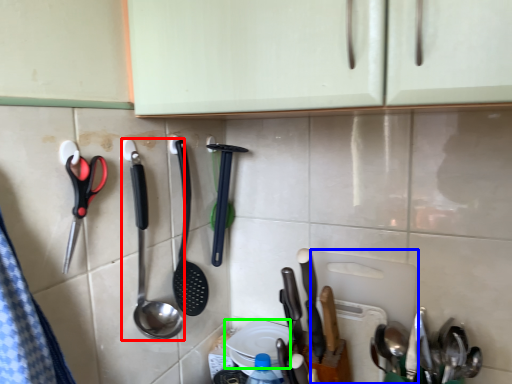
Question: Which is farther away from spoon (highlighted by a red box)? cutting board (highlighted by a blue box) or plate (highlighted by a green box)?

Choices:
 (A) cutting board
 (B) plate

Answer: (A)